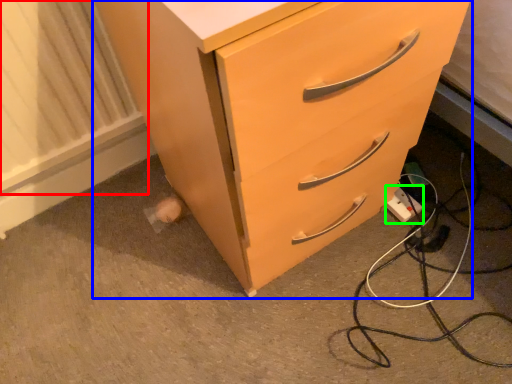
Question: Which object is positioned farthest from radiator (highlighted by a red box)? Select from chest of drawers (highlighted by a blue box) and electric outlet (highlighted by a green box).

Choices:
 (A) chest of drawers
 (B) electric outlet

Answer: (B)